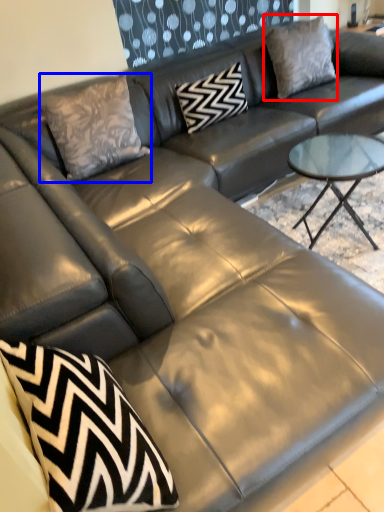
Question: Which of the following is the farthest to the observer, pillow (highlighted by a red box) or throw pillow (highlighted by a blue box)?

Choices:
 (A) pillow
 (B) throw pillow

Answer: (A)